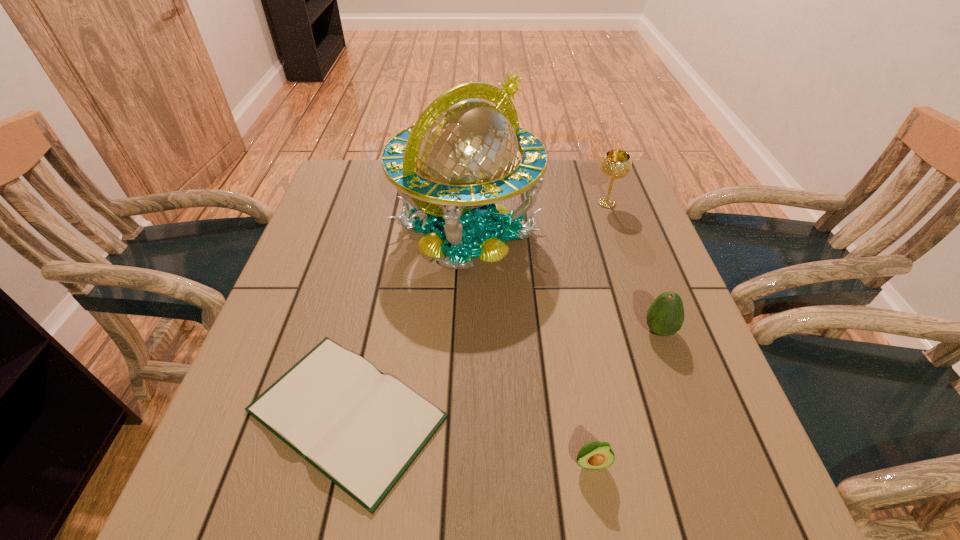
Identify the location of vacant space that is in between the left avocado and the fourth shortest object. The height and width of the screenshot is (540, 960). (599, 333).

The height and width of the screenshot is (540, 960). Identify the location of free space between the left avocado and the fourth shortest object. (599, 333).

Locate an element on the screen. empty space between the globe and the right avocado is located at coordinates (564, 281).

The height and width of the screenshot is (540, 960). What are the coordinates of `empty space that is in between the tallest object and the hardback book` in the screenshot? It's located at pyautogui.click(x=407, y=322).

Where is `vacant point located between the third shortest object and the tallest object`? The height and width of the screenshot is (540, 960). vacant point located between the third shortest object and the tallest object is located at coordinates (564, 281).

Where is `vacant area that lies between the globe and the farther avocado`? This screenshot has height=540, width=960. vacant area that lies between the globe and the farther avocado is located at coordinates (564, 281).

Find the location of a particular element. the fourth closest object relative to the chalice is located at coordinates (593, 455).

The height and width of the screenshot is (540, 960). In order to click on object that is the third closest to the right avocado in this screenshot , I will do `click(615, 164)`.